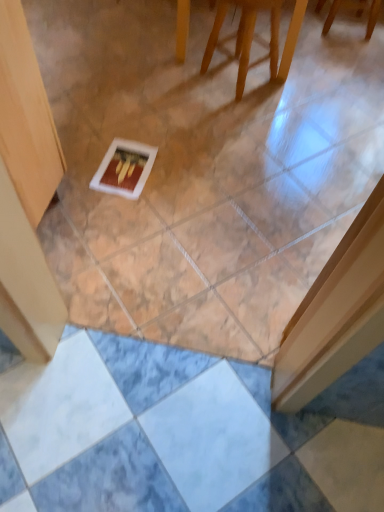
Question: Would you say white matte postcard at center is to the left or to the right of wooden chair at upper center, which appears as the 2th furniture when viewed from the left, in the picture?

Choices:
 (A) left
 (B) right

Answer: (A)

Question: Looking at the image, does white matte postcard at center seem bigger or smaller compared to wooden chair at upper center, which is counted as the second furniture, starting from the front?

Choices:
 (A) small
 (B) big

Answer: (A)

Question: Considering the real-world distances, which object is farthest from the wooden chair at upper center, marked as the 2th furniture in a back-to-front arrangement?

Choices:
 (A) wooden chair at upper center, the second furniture ordered from the bottom
 (B) white matte postcard at center

Answer: (B)

Question: Based on their relative distances, which object is farther from the wooden chair at upper center, arranged as the 2th furniture when viewed from the top?

Choices:
 (A) white matte postcard at center
 (B) wooden chair at upper center, which appears as the 2th furniture when viewed from the left

Answer: (A)